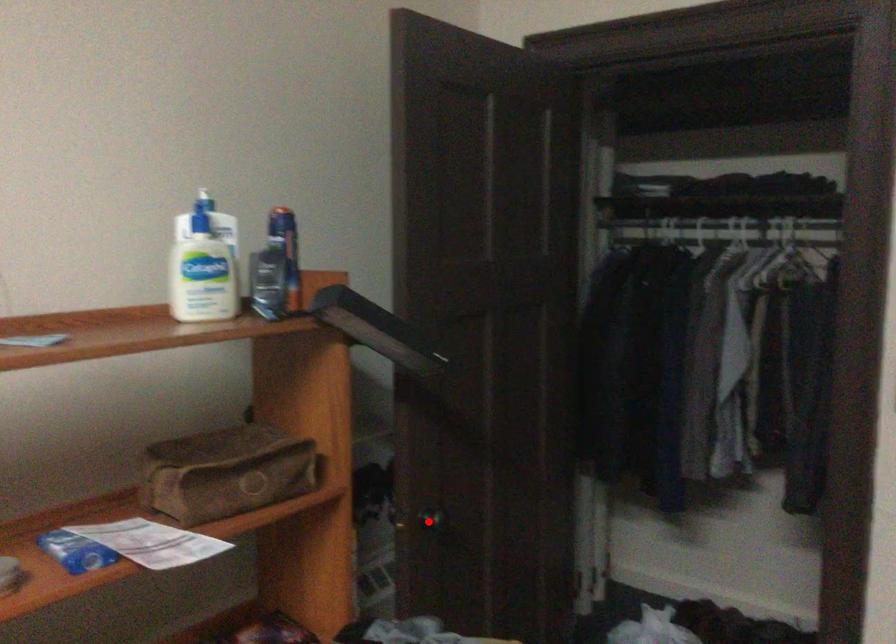
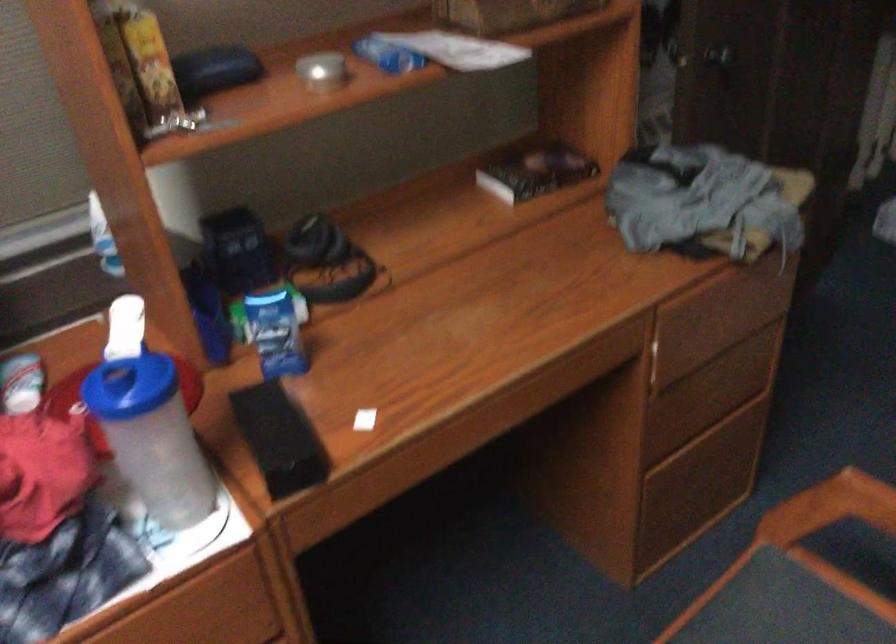
Where in the second image is the point corresponding to the highlighted location from the first image?

(718, 55)